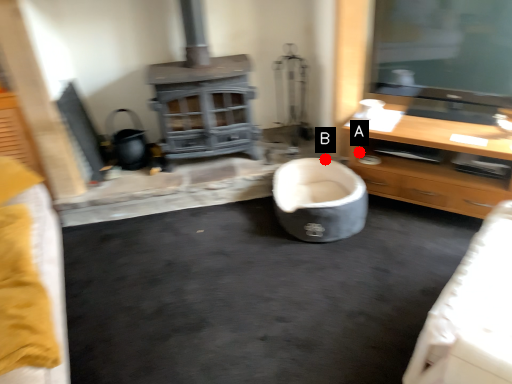
Question: Two points are circled on the image, labeled by A and B beside each circle. Which of the following is the closest to the observer?

Choices:
 (A) A is closer
 (B) B is closer

Answer: (B)